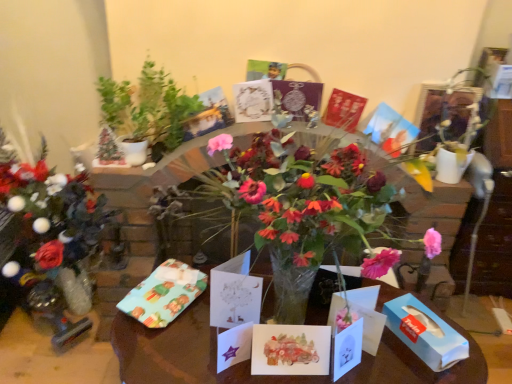
Locate an element on the screen. vacant area that lies between white paper card at center, positioned as the fifth birthday card in top-to-bottom order, and blue paper tissue box at lower right is located at coordinates (384, 361).